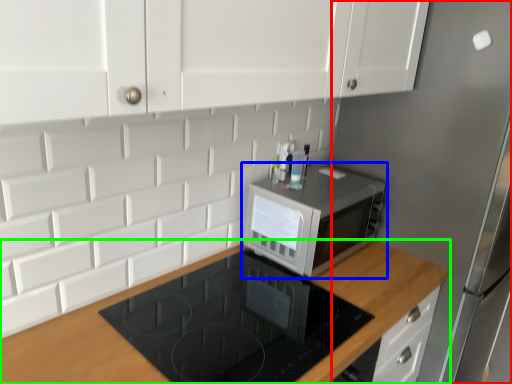
Question: Which object is positioned farthest from fridge (highlighted by a red box)? Select from microwave oven (highlighted by a blue box) and countertop (highlighted by a green box).

Choices:
 (A) microwave oven
 (B) countertop

Answer: (B)